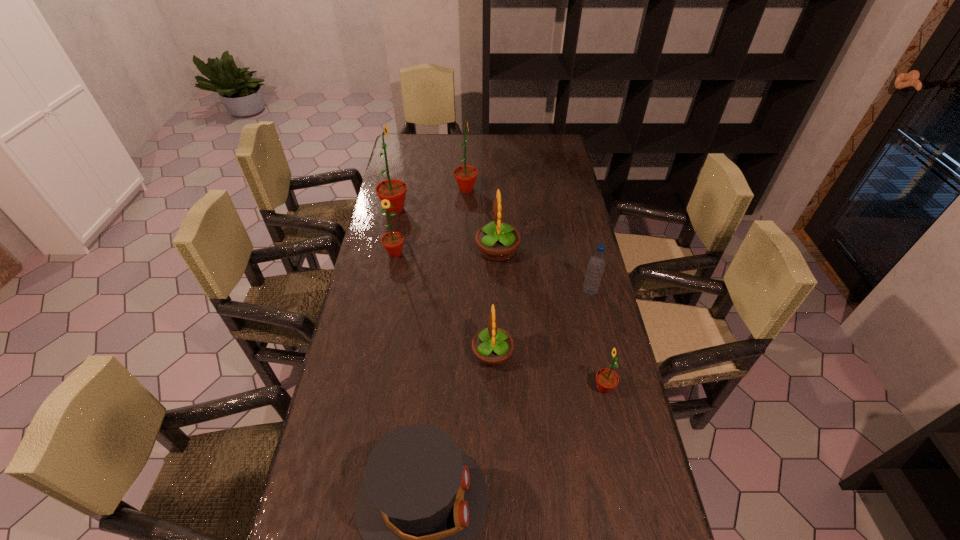
Where is `the second nearest object`? This screenshot has height=540, width=960. the second nearest object is located at coordinates (606, 379).

This screenshot has height=540, width=960. What are the coordinates of `the rightmost sunflower` in the screenshot? It's located at (606, 379).

Locate an element on the screen. Image resolution: width=960 pixels, height=540 pixels. free space located 0.190m on the face of the seventh nearest object is located at coordinates (458, 209).

Where is `vacant position located on the face of the third green sunflower from left to right`? vacant position located on the face of the third green sunflower from left to right is located at coordinates (529, 190).

You are a GUI agent. You are given a task and a screenshot of the screen. Output one action in this format:
    pyautogui.click(x=<x>, y=<y>)
    Task: Click on the vacant space situated on the face of the farther yellow sunflower
    Image resolution: width=960 pixels, height=540 pixels.
    Given the screenshot: What is the action you would take?
    pyautogui.click(x=394, y=251)

What are the coordinates of `free region located 0.070m on the face of the farther yellow sunflower` in the screenshot? It's located at [x=456, y=251].

Where is `free space located 0.110m on the face of the farther yellow sunflower`? free space located 0.110m on the face of the farther yellow sunflower is located at coordinates (444, 251).

The height and width of the screenshot is (540, 960). Find the location of `free space located 0.290m on the face of the second nearest green sunflower`. free space located 0.290m on the face of the second nearest green sunflower is located at coordinates (380, 328).

Find the location of a particular element. This screenshot has width=960, height=540. vacant space situated on the back of the fourth nearest object is located at coordinates (584, 267).

Locate an element on the screen. vacant space located 0.220m on the face of the nearer yellow sunflower is located at coordinates (396, 354).